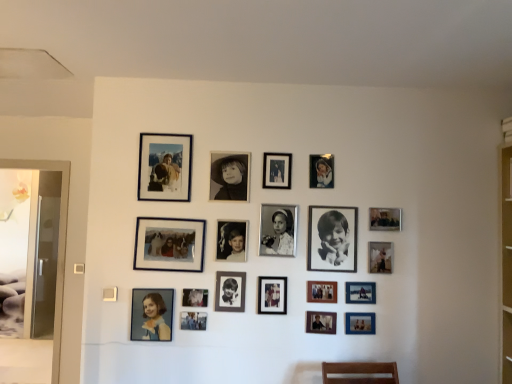
Question: From the image's perspective, is black matte photo frame at center, marked as the thirteenth picture frame in a right-to-left arrangement, located above or below metallic silver photo frame at lower center, which appears as the fourth picture frame when viewed from the left?

Choices:
 (A) above
 (B) below

Answer: (A)

Question: From a real-world perspective, relative to metallic silver photo frame at lower center, which is the 15th picture frame in right-to-left order, is black matte photo frame at center, marked as the thirteenth picture frame in a right-to-left arrangement, vertically above or below?

Choices:
 (A) above
 (B) below

Answer: (A)

Question: Estimate the real-world distances between objects in this image. Which object is farther from the matte silver photo frame at center, the fourteenth picture frame when ordered from right to left?

Choices:
 (A) matte black portrait at lower left, the eighteenth picture frame in the right-to-left sequence
 (B) black matte portrait at center, the 4th picture frame in the right-to-left sequence
 (C) black glossy photo frame at center, the eighth picture frame in the left-to-right sequence
 (D) metallic silver photo frame at lower center, which is counted as the 12th picture frame, starting from the left
 (E) matte black photo frame at center, which is the 3th picture frame in left-to-right order

Answer: (B)

Question: Which is farther from the matte black photo frame at center, placed as the 10th picture frame when sorted from right to left?

Choices:
 (A) metallic silver photo frame at lower center, which is the 15th picture frame in right-to-left order
 (B) black matte photo frame at center, the seventh picture frame from the left
 (C) matte black photo frame at center, which appears as the 16th picture frame when viewed from the right
 (D) matte black photo frame at upper left, which is the second picture frame from left to right
 (E) matte black portrait at lower left, positioned as the first picture frame in left-to-right order

Answer: (D)